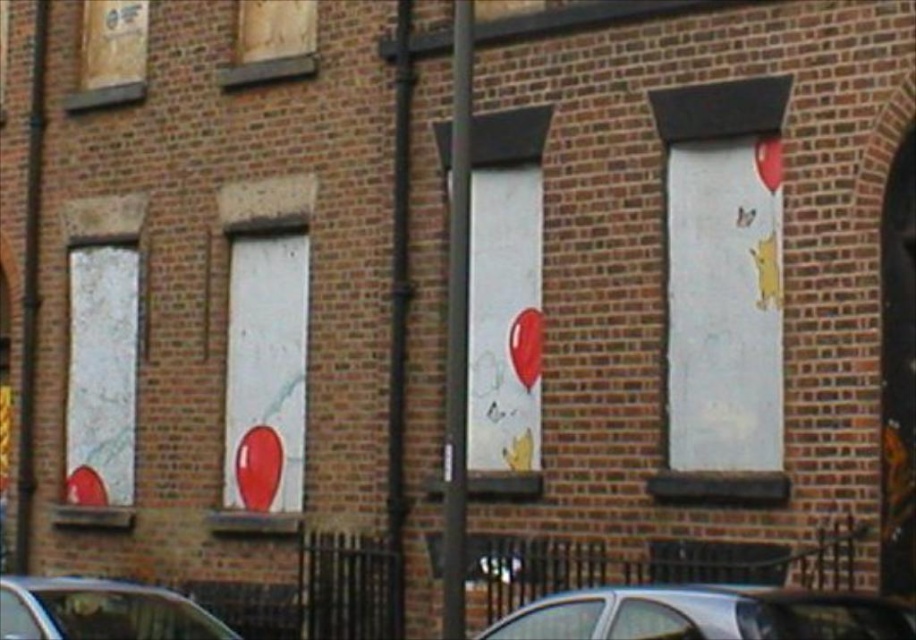
You are driving a car that is 5 meters long. You want to park your car between the silver metallic car at lower center and the brushed metal pole at left. Is there enough space between them to park your car?

The distance between the silver metallic car at lower center and the brushed metal pole at left is 10.27 meters. Since your car is only 5 meters long, there is enough space to park between them.

You are standing 10 meters away from a brick building with four windows. You want to touch the point at coordinates point [744,612] on the third window. Can you reach it without moving closer?

The point [744,612] is 8.55 meters from the camera. Since you are already 10 meters away, you are too far to reach it without moving closer.